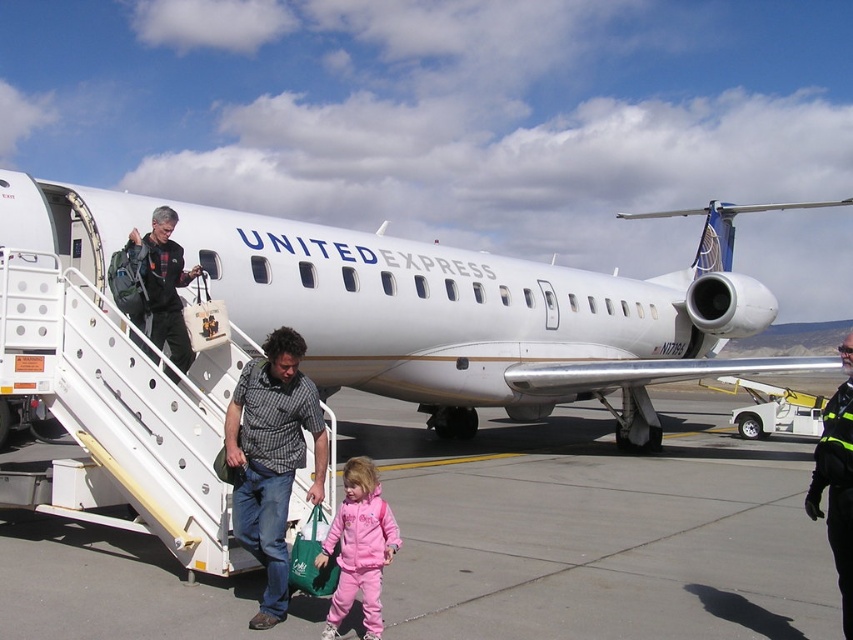
Can you confirm if plaid shirt at center is taller than pink fleece jacket at lower center?

Yes, plaid shirt at center is taller than pink fleece jacket at lower center.

Can you confirm if plaid shirt at center is positioned to the right of pink fleece jacket at lower center?

Incorrect, plaid shirt at center is not on the right side of pink fleece jacket at lower center.

This screenshot has width=853, height=640. Identify the location of plaid shirt at center. (271, 458).

Between black reflective jacket at lower right and plaid flannel shirt at upper left, which one is positioned lower?

black reflective jacket at lower right is lower down.

Who is positioned more to the right, black reflective jacket at lower right or plaid flannel shirt at upper left?

black reflective jacket at lower right

Is point (851, 577) farther from viewer compared to point (158, 260)?

No, (851, 577) is closer to viewer.

What are the coordinates of `black reflective jacket at lower right` in the screenshot? It's located at (836, 481).

Does gray concrete tarmac at center appear under pink fleece jacket at lower center?

Indeed, gray concrete tarmac at center is positioned under pink fleece jacket at lower center.

Can you confirm if gray concrete tarmac at center is shorter than pink fleece jacket at lower center?

Yes.

At what (x,y) coordinates should I click in order to perform the action: click on gray concrete tarmac at center. Please return your answer as a coordinate pair (x, y). Image resolution: width=853 pixels, height=640 pixels. Looking at the image, I should click on (x=596, y=529).